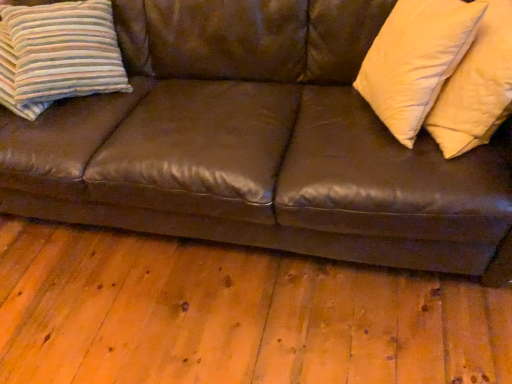
Question: From a real-world perspective, is striped fabric pillow at left, which ranks as the 1th pillow in left-to-right order, above or below brown leather couch at center?

Choices:
 (A) below
 (B) above

Answer: (B)

Question: From the image's perspective, relative to brown leather couch at center, is striped fabric pillow at left, acting as the third pillow starting from the right, above or below?

Choices:
 (A) below
 (B) above

Answer: (B)

Question: Which object is the farthest from the soft cream pillow at right, placed as the second pillow when sorted from right to left?

Choices:
 (A) soft yellow pillow at right, which is counted as the 1th pillow, starting from the right
 (B) striped fabric pillow at left, acting as the third pillow starting from the right
 (C) brown leather couch at center

Answer: (B)

Question: Which object is the farthest from the soft cream pillow at right, placed as the second pillow when sorted from right to left?

Choices:
 (A) striped fabric pillow at left, acting as the third pillow starting from the right
 (B) soft yellow pillow at right, the third pillow from the left
 (C) brown leather couch at center

Answer: (A)